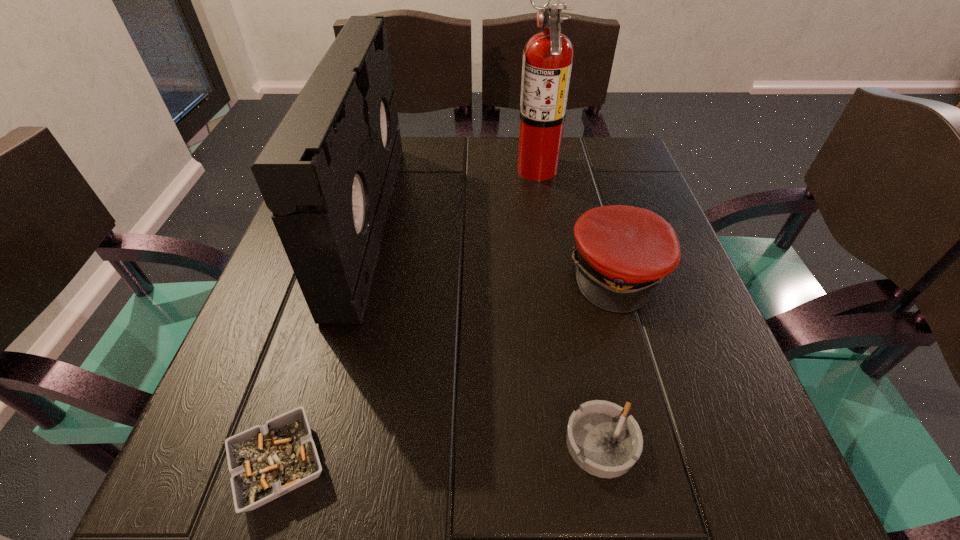
Where is `vacant space located on the back of the right ashtray`? The width and height of the screenshot is (960, 540). vacant space located on the back of the right ashtray is located at coordinates (588, 372).

Locate an element on the screen. free location located 0.170m on the back of the left ashtray is located at coordinates (324, 320).

The width and height of the screenshot is (960, 540). Identify the location of fire extinguisher at the far edge. (547, 62).

The height and width of the screenshot is (540, 960). I want to click on videotape that is positioned at the far edge, so click(327, 173).

The image size is (960, 540). Identify the location of videotape that is at the left edge. (327, 173).

You are a GUI agent. You are given a task and a screenshot of the screen. Output one action in this format:
    pyautogui.click(x=<x>, y=<y>)
    Task: Click on the ashtray positioned at the left edge
    Image resolution: width=960 pixels, height=540 pixels.
    Given the screenshot: What is the action you would take?
    pyautogui.click(x=266, y=461)

Where is `object positioned at the right edge`? The image size is (960, 540). object positioned at the right edge is located at coordinates (622, 252).

Locate an element on the screen. Image resolution: width=960 pixels, height=540 pixels. object situated at the far left corner is located at coordinates (327, 173).

In order to click on object situated at the near left corner in this screenshot , I will do `click(266, 461)`.

At what (x,y) coordinates should I click in order to perform the action: click on vacant space at the far edge of the desktop. Please return your answer as a coordinate pair (x, y). The image size is (960, 540). Looking at the image, I should click on (564, 164).